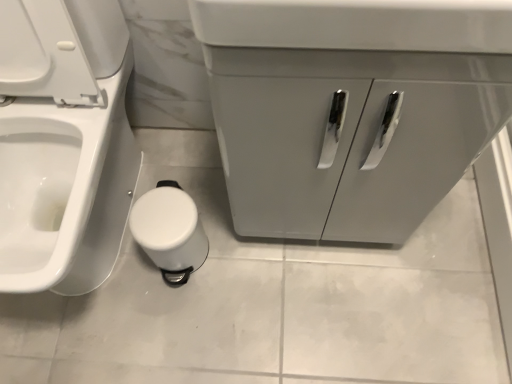
Question: From the image's perspective, would you say white glossy toilet at lower left is shown under white plastic toilet paper at lower center?

Choices:
 (A) yes
 (B) no

Answer: (B)

Question: Is white glossy toilet at lower left located outside white plastic toilet paper at lower center?

Choices:
 (A) no
 (B) yes

Answer: (B)

Question: Considering the relative sizes of white glossy toilet at lower left and white plastic toilet paper at lower center in the image provided, is white glossy toilet at lower left smaller than white plastic toilet paper at lower center?

Choices:
 (A) no
 (B) yes

Answer: (A)

Question: Considering the relative positions of white glossy toilet at lower left and white plastic toilet paper at lower center in the image provided, is white glossy toilet at lower left to the right of white plastic toilet paper at lower center from the viewer's perspective?

Choices:
 (A) no
 (B) yes

Answer: (A)

Question: Does white glossy toilet at lower left have a larger size compared to white plastic toilet paper at lower center?

Choices:
 (A) no
 (B) yes

Answer: (B)

Question: Is white glossy toilet at lower left oriented away from white plastic toilet paper at lower center?

Choices:
 (A) yes
 (B) no

Answer: (B)

Question: From the image's perspective, does white plastic toilet paper at lower center appear higher than white glossy toilet at lower left?

Choices:
 (A) yes
 (B) no

Answer: (B)

Question: Is white plastic toilet paper at lower center positioned in front of white glossy toilet at lower left?

Choices:
 (A) yes
 (B) no

Answer: (B)

Question: Would you say white plastic toilet paper at lower center contains white glossy toilet at lower left?

Choices:
 (A) yes
 (B) no

Answer: (B)

Question: Would you say white plastic toilet paper at lower center is outside white glossy toilet at lower left?

Choices:
 (A) no
 (B) yes

Answer: (B)

Question: Is white plastic toilet paper at lower center further to camera compared to white glossy toilet at lower left?

Choices:
 (A) yes
 (B) no

Answer: (A)

Question: From a real-world perspective, is white plastic toilet paper at lower center positioned under white glossy toilet at lower left based on gravity?

Choices:
 (A) yes
 (B) no

Answer: (A)

Question: Is matte gray cabinet at center surrounding white glossy toilet at lower left?

Choices:
 (A) yes
 (B) no

Answer: (B)